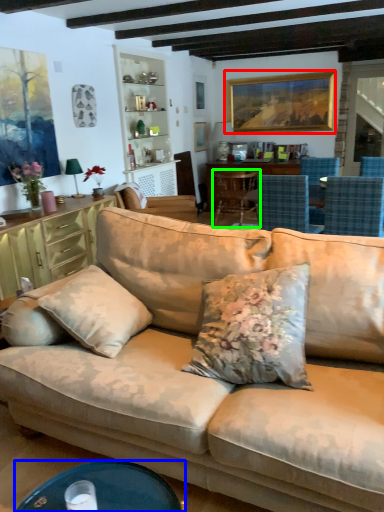
Question: Which is nearer to the picture frame (highlighted by a red box)? desk (highlighted by a blue box) or chair (highlighted by a green box).

Choices:
 (A) desk
 (B) chair

Answer: (B)